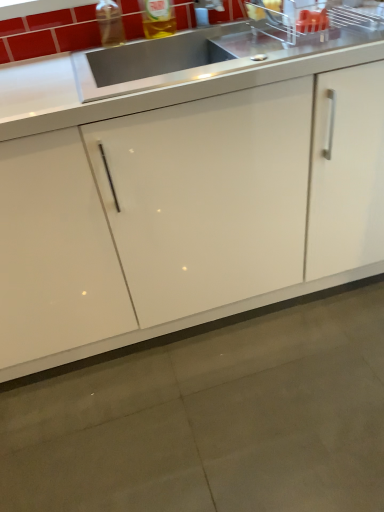
Find the location of a particular element. translucent plastic bottle at upper center is located at coordinates (158, 18).

This screenshot has width=384, height=512. What do you see at coordinates (110, 23) in the screenshot? I see `transparent plastic bottle at upper left` at bounding box center [110, 23].

Describe the element at coordinates (226, 203) in the screenshot. I see `white glossy cabinet at center` at that location.

The height and width of the screenshot is (512, 384). Identify the location of translucent plastic bottle at upper center. (158, 18).

Which is more distant, [169,303] or [140,2]?

The point [140,2] is farther.

Is there a large distance between white glossy cabinet at center and translucent plastic bottle at upper center?

Actually, white glossy cabinet at center and translucent plastic bottle at upper center are a little close together.

How distant is white glossy cabinet at center from translucent plastic bottle at upper center?

A distance of 30.77 inches exists between white glossy cabinet at center and translucent plastic bottle at upper center.

How different are the orientations of white glossy cabinet at center and translucent plastic bottle at upper center in degrees?

1.71 degrees.

Does transparent plastic bottle at upper left have a larger size compared to translucent plastic bottle at upper center?

No, transparent plastic bottle at upper left is not bigger than translucent plastic bottle at upper center.

Locate an element on the screen. This screenshot has width=384, height=512. bottle below the translucent plastic bottle at upper center (from the image's perspective) is located at coordinates (110, 23).

Which is correct: transparent plastic bottle at upper left is inside translucent plastic bottle at upper center, or outside of it?

transparent plastic bottle at upper left is not inside translucent plastic bottle at upper center, it's outside.

Between transparent plastic bottle at upper left and translucent plastic bottle at upper center, which one is positioned in front?

translucent plastic bottle at upper center is in front.

Which object is further away from the camera, satin steel sink at upper center or translucent plastic bottle at upper center?

translucent plastic bottle at upper center is further from the camera.

From a real-world perspective, which object stands above the other?

translucent plastic bottle at upper center, from a real-world perspective.

Can you confirm if satin steel sink at upper center is thinner than translucent plastic bottle at upper center?

In fact, satin steel sink at upper center might be wider than translucent plastic bottle at upper center.

Consider the image. Is translucent plastic bottle at upper center at the back of satin steel sink at upper center?

No, satin steel sink at upper center is not facing away from translucent plastic bottle at upper center.

Is transparent plastic bottle at upper left at the back of white glossy cabinet at center?

white glossy cabinet at center is not turned away from transparent plastic bottle at upper left.

How many degrees apart are the facing directions of white glossy cabinet at center and transparent plastic bottle at upper left?

1.71 degrees.

The image size is (384, 512). I want to click on cabinetry below the transparent plastic bottle at upper left (from the image's perspective), so click(226, 203).

Does translucent plastic bottle at upper center come behind transparent plastic bottle at upper left?

No, translucent plastic bottle at upper center is in front of transparent plastic bottle at upper left.

Is translucent plastic bottle at upper center not close to transparent plastic bottle at upper left?

That's not correct — translucent plastic bottle at upper center is a little close to transparent plastic bottle at upper left.

From the image's perspective, does translucent plastic bottle at upper center appear lower than transparent plastic bottle at upper left?

Incorrect, from the image's perspective, translucent plastic bottle at upper center is higher than transparent plastic bottle at upper left.

I want to click on bottle behind the translucent plastic bottle at upper center, so click(x=110, y=23).

Is satin steel sink at upper center completely or partially outside of white glossy cabinet at center?

No, satin steel sink at upper center is inside or overlapping with white glossy cabinet at center.

You are a GUI agent. You are given a task and a screenshot of the screen. Output one action in this format:
    pyautogui.click(x=<x>, y=<y>)
    Task: Click on the cabinetry in front of the satin steel sink at upper center
    This screenshot has height=512, width=384.
    Given the screenshot: What is the action you would take?
    pyautogui.click(x=226, y=203)

Between point (303, 62) and point (314, 123), which one is positioned in front?

Positioned in front is point (303, 62).

Does satin steel sink at upper center have a lesser width compared to white glossy cabinet at center?

Correct, the width of satin steel sink at upper center is less than that of white glossy cabinet at center.

Considering the sizes of objects satin steel sink at upper center and transparent plastic bottle at upper left in the image provided, who is thinner, satin steel sink at upper center or transparent plastic bottle at upper left?

transparent plastic bottle at upper left.

Between satin steel sink at upper center and transparent plastic bottle at upper left, which one has less height?

satin steel sink at upper center.

Is satin steel sink at upper center inside the boundaries of transparent plastic bottle at upper left, or outside?

satin steel sink at upper center is not enclosed by transparent plastic bottle at upper left.

This screenshot has width=384, height=512. Identify the location of cabinetry located underneath the translucent plastic bottle at upper center (from a real-world perspective). pyautogui.click(x=226, y=203).

This screenshot has width=384, height=512. I want to click on bottle behind the translucent plastic bottle at upper center, so click(110, 23).

Estimate the real-world distances between objects in this image. Which object is further from transparent plastic bottle at upper left, white glossy cabinet at center or translucent plastic bottle at upper center?

white glossy cabinet at center lies further to transparent plastic bottle at upper left than the other object.

Which object lies further to the anchor point transparent plastic bottle at upper left, white glossy cabinet at center or satin steel sink at upper center?

white glossy cabinet at center is further to transparent plastic bottle at upper left.

Which object lies nearer to the anchor point satin steel sink at upper center, translucent plastic bottle at upper center or white glossy cabinet at center?

Based on the image, white glossy cabinet at center appears to be nearer to satin steel sink at upper center.

Consider the image. From the image, which object appears to be farther from satin steel sink at upper center, translucent plastic bottle at upper center or transparent plastic bottle at upper left?

The object further to satin steel sink at upper center is translucent plastic bottle at upper center.

Which object lies nearer to the anchor point white glossy cabinet at center, translucent plastic bottle at upper center or satin steel sink at upper center?

satin steel sink at upper center lies closer to white glossy cabinet at center than the other object.

Based on the photo, estimate the real-world distances between objects in this image. Which object is closer to satin steel sink at upper center, transparent plastic bottle at upper left or translucent plastic bottle at upper center?

transparent plastic bottle at upper left is positioned closer to the anchor satin steel sink at upper center.

Considering their positions, is transparent plastic bottle at upper left positioned further to satin steel sink at upper center than white glossy cabinet at center?

transparent plastic bottle at upper left lies further to satin steel sink at upper center than the other object.

From the picture: Estimate the real-world distances between objects in this image. Which object is further from white glossy cabinet at center, transparent plastic bottle at upper left or satin steel sink at upper center?

transparent plastic bottle at upper left is positioned further to the anchor white glossy cabinet at center.

I want to click on beverage situated between transparent plastic bottle at upper left and satin steel sink at upper center from left to right, so tap(158, 18).

The height and width of the screenshot is (512, 384). Identify the location of bottle that lies between translucent plastic bottle at upper center and white glossy cabinet at center from top to bottom. (110, 23).

Where is `countertop that lies between translucent plastic bottle at upper center and white glossy cabinet at center from top to bottom`? Image resolution: width=384 pixels, height=512 pixels. countertop that lies between translucent plastic bottle at upper center and white glossy cabinet at center from top to bottom is located at coordinates (154, 86).

I want to click on countertop between transparent plastic bottle at upper left and white glossy cabinet at center from top to bottom, so click(154, 86).